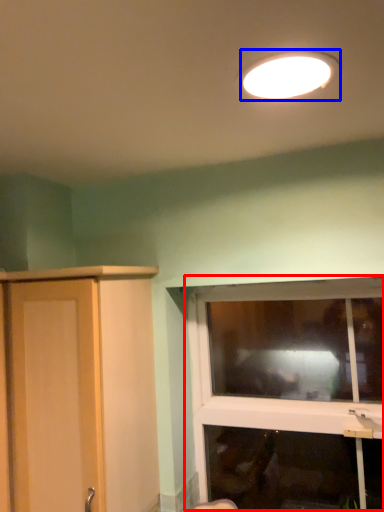
Question: Which of the following is the farthest to the observer, window (highlighted by a red box) or lamp (highlighted by a blue box)?

Choices:
 (A) window
 (B) lamp

Answer: (A)